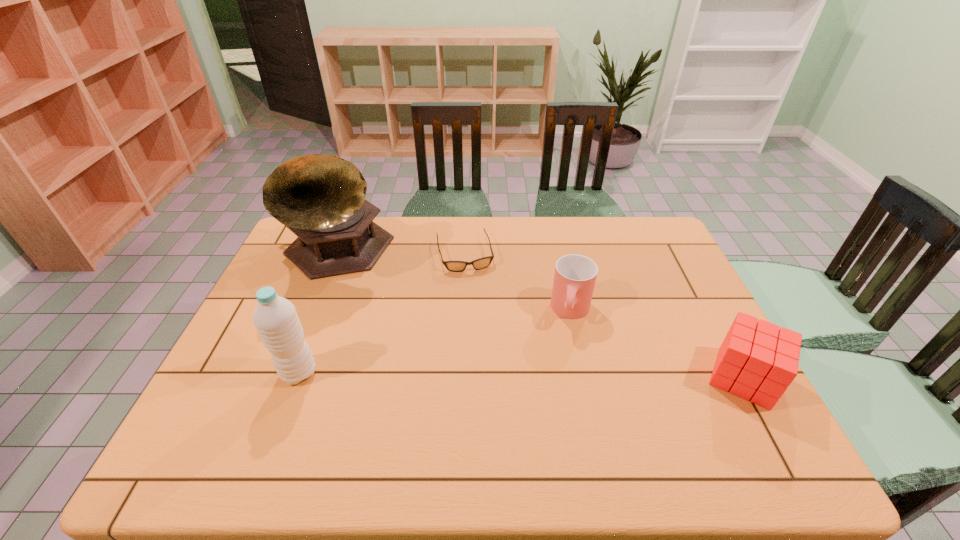
The width and height of the screenshot is (960, 540). What are the coordinates of `vacant region located 0.120m on the front-facing side of the shortest object` in the screenshot? It's located at (476, 299).

Where is `vacant space located on the side of the cup with the handle`? This screenshot has width=960, height=540. vacant space located on the side of the cup with the handle is located at coordinates (563, 368).

Where is `vacant space positioned 0.050m on the side of the cup with the handle`? The width and height of the screenshot is (960, 540). vacant space positioned 0.050m on the side of the cup with the handle is located at coordinates (567, 345).

At what (x,y) coordinates should I click in order to perform the action: click on free spot located on the side of the cup with the handle. Please return your answer as a coordinate pair (x, y). Looking at the image, I should click on (562, 372).

Find the location of a particular element. This screenshot has height=540, width=960. free space located 0.380m on the horn direction of the phonograph record is located at coordinates (447, 357).

In order to click on vacant space situated on the horn direction of the phonograph record in this screenshot , I will do `click(425, 338)`.

Locate an element on the screen. The image size is (960, 540). free space located on the horn direction of the phonograph record is located at coordinates (452, 361).

At what (x,y) coordinates should I click in order to perform the action: click on sunglasses that is at the far edge. Please return your answer as a coordinate pair (x, y). Looking at the image, I should click on (455, 266).

The width and height of the screenshot is (960, 540). Find the location of `phonograph record at the far edge`. phonograph record at the far edge is located at coordinates (321, 198).

I want to click on object that is at the near edge, so click(x=757, y=361).